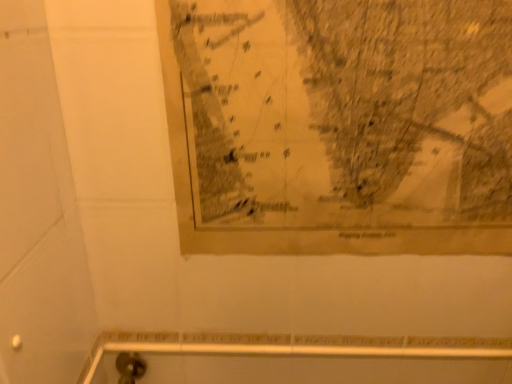
Describe the element at coordinates (340, 125) in the screenshot. I see `yellowed paper map at upper center` at that location.

The image size is (512, 384). I want to click on yellowed paper map at upper center, so click(x=340, y=125).

The height and width of the screenshot is (384, 512). What are the coordinates of `yellowed paper map at upper center` in the screenshot? It's located at (340, 125).